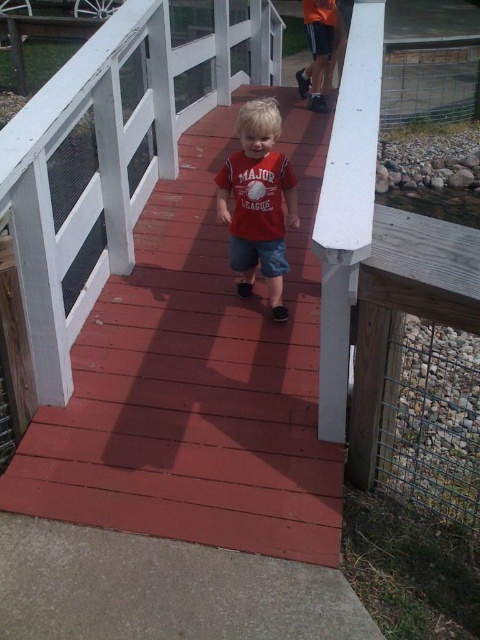
You are a GUI agent. You are given a task and a screenshot of the screen. Output one action in this format:
    pyautogui.click(x=<x>, y=<y>)
    Task: Click on the red wood deck at center
    This screenshot has width=480, height=640.
    Given the screenshot: What is the action you would take?
    (195, 381)

The image size is (480, 640). What do you see at coordinates (195, 381) in the screenshot?
I see `red wood deck at center` at bounding box center [195, 381].

I want to click on red wood deck at center, so click(x=195, y=381).